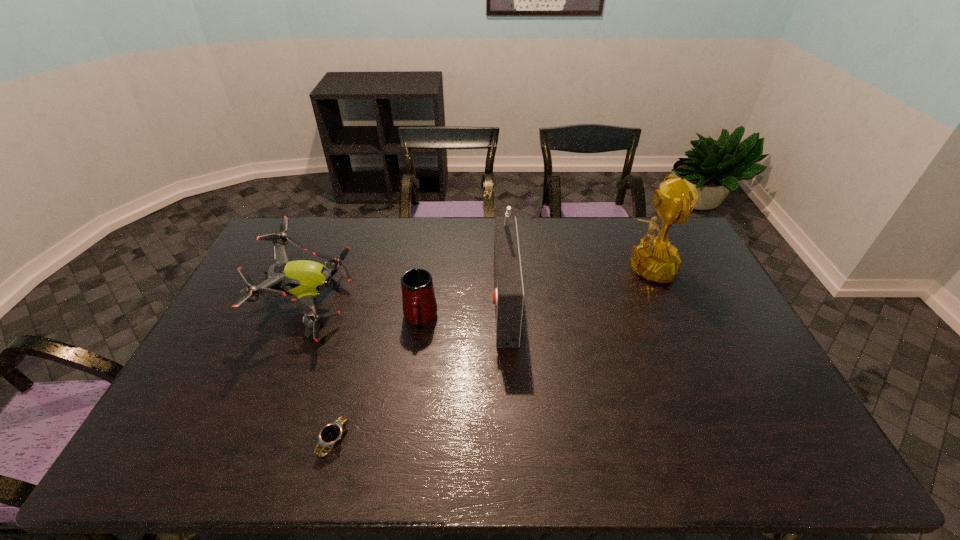
At what (x,y) coordinates should I click in order to perform the action: click on free space located on the front side of the rightmost object. Please return your answer as a coordinate pair (x, y). Looking at the image, I should click on (501, 267).

You are a GUI agent. You are given a task and a screenshot of the screen. Output one action in this format:
    pyautogui.click(x=<x>, y=<y>)
    Task: Click on the vacant space located 0.210m on the front panel of the radio receiver
    This screenshot has width=960, height=540.
    Given the screenshot: What is the action you would take?
    pyautogui.click(x=426, y=300)

Find the location of a particular element. The width and height of the screenshot is (960, 540). vacant space situated 0.110m on the front panel of the radio receiver is located at coordinates (457, 300).

I want to click on free location located on the front panel of the radio receiver, so click(x=423, y=300).

Identify the location of free point located on the front-facing side of the third shortest object. This screenshot has height=540, width=960. (392, 306).

I want to click on vacant space located 0.110m on the side of the mug with the handle, so click(414, 367).

The height and width of the screenshot is (540, 960). In order to click on vacant point located on the left of the nearest object in this screenshot , I will do `click(198, 441)`.

Locate an element on the screen. object situated at the far edge is located at coordinates (655, 259).

Locate an element on the screen. object that is at the near edge is located at coordinates 331,433.

Where is `object that is at the left edge`? Image resolution: width=960 pixels, height=540 pixels. object that is at the left edge is located at coordinates (304, 279).